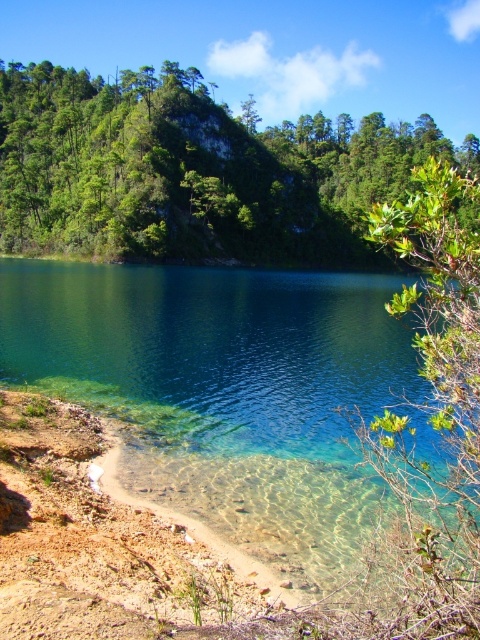
You are standing at the center of the shoreline and want to take a photo of the green leafy trees at upper center. In which direction should you point your camera to capture them?

The green leafy trees at upper center are located at point coordinates, so you should point your camera towards the upper center direction to capture them.

You are standing at the edge of the lake and see two points marked in the image. Which point is closer to you, point (349, 259) or point (100, 285)?

Point (100, 285) is closer to you because it is less further to the camera than point (349, 259).